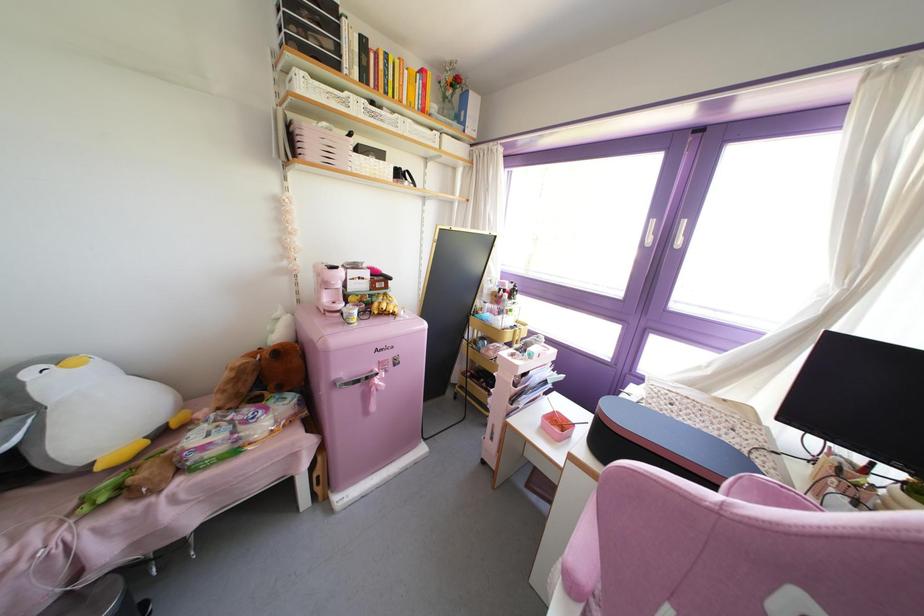
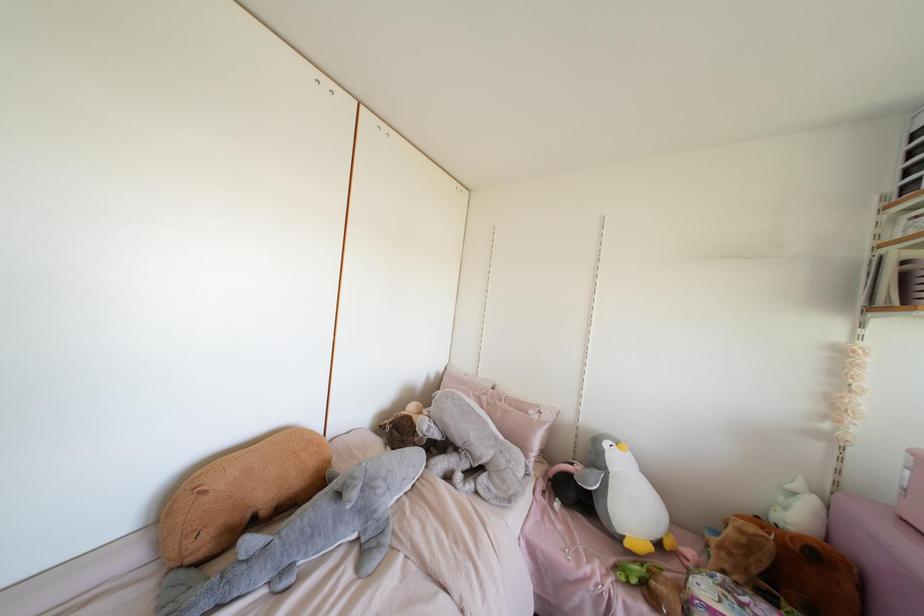
Find the pixel in the second image that matches pixel 232 369 in the first image.

(739, 531)